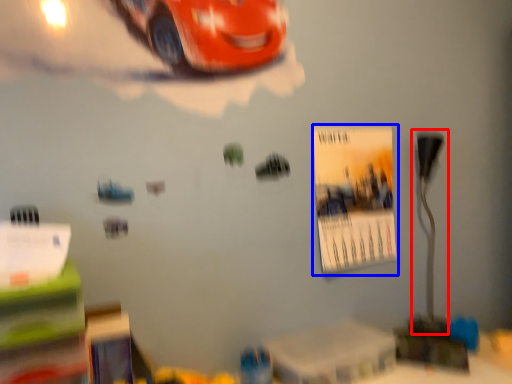
Question: Which point is closer to the camera, table lamp (highlighted by a red box) or poster page (highlighted by a blue box)?

Choices:
 (A) table lamp
 (B) poster page

Answer: (B)